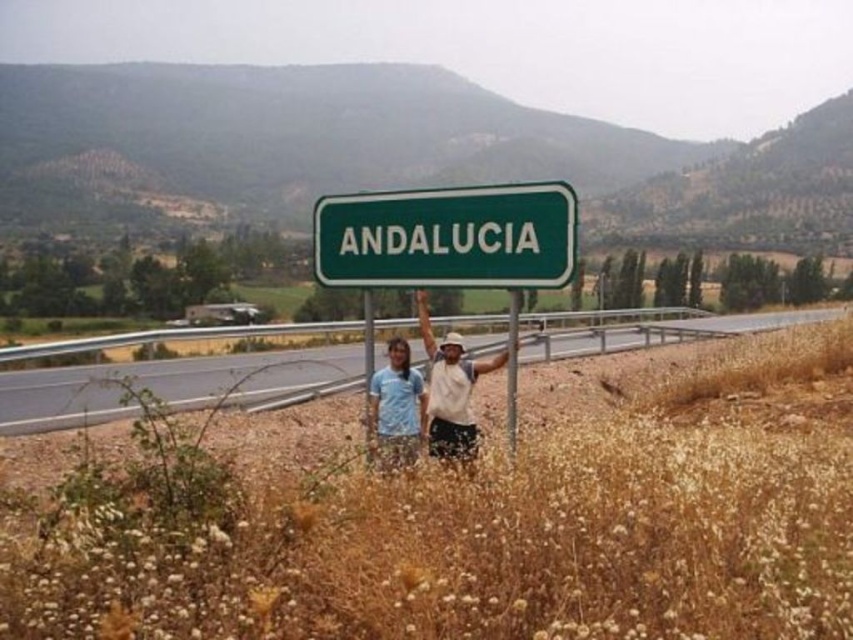
You are a photographer standing at the edge of the gray asphalt highway at center. You want to capture a photo of the blue fabric pants at center without the highway blocking the view. Is the highway currently blocking the pants in the image?

The gray asphalt highway at center is above the blue fabric pants at center, so the highway is blocking the view of the pants in the image.

In the scene shown: You are a photographer trying to capture a shot of the green metallic signpost at center and the white cotton shirt at center. From the photographer perspective, which object is positioned to the right side?

The white cotton shirt at center is positioned to the right of the green metallic signpost at center.